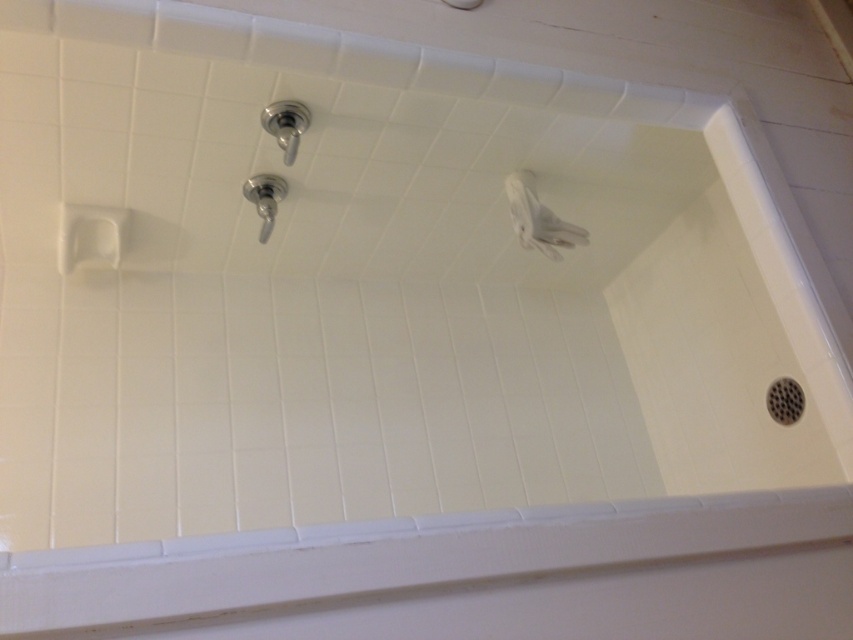
Question: Which point is farther to the camera?

Choices:
 (A) satin nickel showerhead at upper center
 (B) satin nickel faucet at upper center

Answer: (B)

Question: Which of the following is the closest to the observer?

Choices:
 (A) (267, 129)
 (B) (267, 182)

Answer: (A)

Question: Does satin nickel showerhead at upper center have a greater width compared to satin nickel faucet at upper center?

Choices:
 (A) no
 (B) yes

Answer: (A)

Question: Is satin nickel showerhead at upper center in front of satin nickel faucet at upper center?

Choices:
 (A) yes
 (B) no

Answer: (A)

Question: Is satin nickel showerhead at upper center thinner than satin nickel faucet at upper center?

Choices:
 (A) no
 (B) yes

Answer: (B)